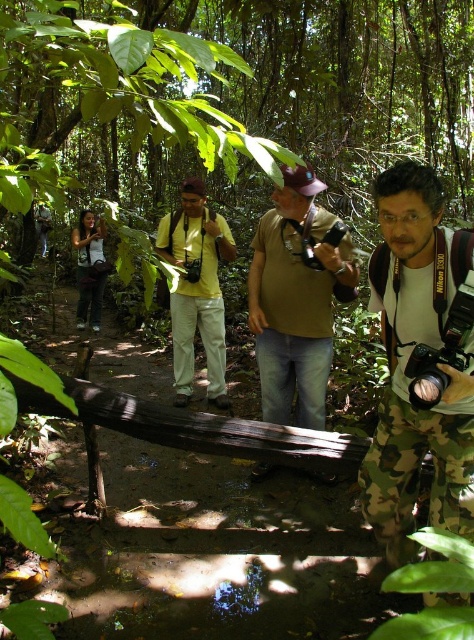
You are a photographer carrying a matte black camera at left and wearing a brown matte shirt at center. You want to ensure your camera doesn not get wet while crossing a shallow stream. Which item should you hold higher to keep it dry?

The brown matte shirt at center is larger in size than the matte black camera at left, so you should hold the matte black camera at left higher to keep it dry since it is smaller and easier to lift above the water.